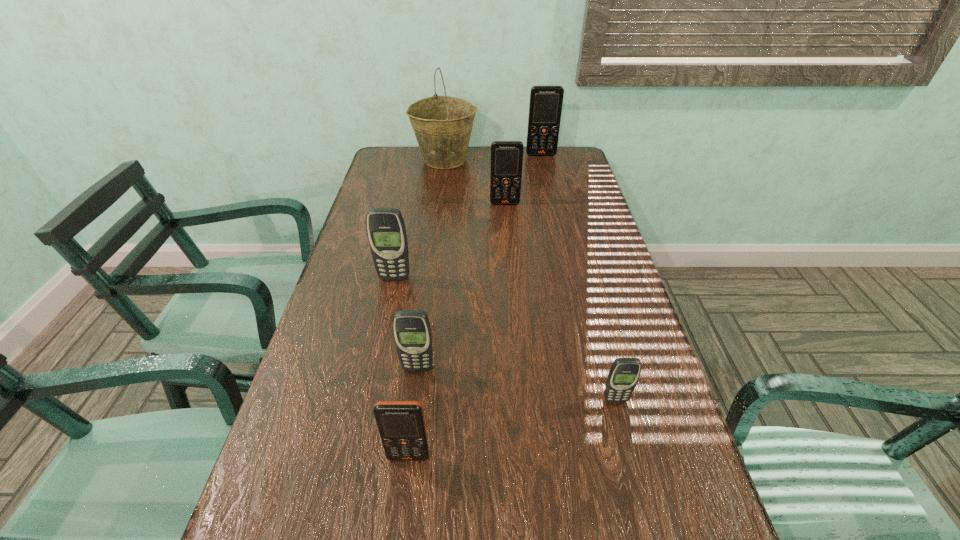
Locate an element on the screen. The width and height of the screenshot is (960, 540). the tallest object is located at coordinates (442, 125).

This screenshot has width=960, height=540. I want to click on the tallest cellular telephone, so click(x=545, y=107).

Locate an element on the screen. This screenshot has width=960, height=540. the sixth shortest object is located at coordinates (545, 107).

What are the coordinates of `the fourth cellular telephone from left to right` in the screenshot? It's located at (506, 156).

The width and height of the screenshot is (960, 540). In order to click on the fifth nearest cellular telephone in this screenshot , I will do `click(506, 156)`.

I want to click on the biggest gray cellular telephone, so click(386, 232).

Find the location of `the leftmost cellular telephone`. the leftmost cellular telephone is located at coordinates (386, 232).

The height and width of the screenshot is (540, 960). I want to click on the second biggest gray cellular telephone, so click(x=412, y=333).

Identify the location of the fifth farthest object. The height and width of the screenshot is (540, 960). (412, 333).

Image resolution: width=960 pixels, height=540 pixels. What are the coordinates of `the smallest orange cellular telephone` in the screenshot? It's located at (401, 424).